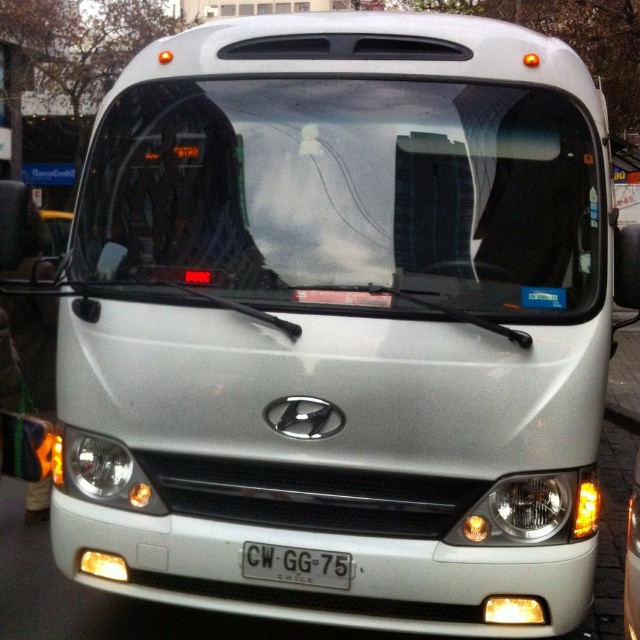
Question: Can you confirm if clear glass windshield at center is positioned above white plastic license plate at center?

Choices:
 (A) yes
 (B) no

Answer: (A)

Question: Can you confirm if clear glass windshield at center is positioned to the left of white plastic license plate at center?

Choices:
 (A) yes
 (B) no

Answer: (B)

Question: Which of the following is the farthest from the observer?

Choices:
 (A) clear glass windshield at center
 (B) matte white headlight at center
 (C) white plastic license plate at center

Answer: (B)

Question: Which point is closer to the camera taking this photo?

Choices:
 (A) (83, 454)
 (B) (202, 177)

Answer: (A)

Question: Can you confirm if white plastic license plate at center is bigger than matte white headlight at center?

Choices:
 (A) no
 (B) yes

Answer: (A)

Question: Among these objects, which one is nearest to the camera?

Choices:
 (A) white plastic license plate at center
 (B) clear glass windshield at center
 (C) matte white headlight at center

Answer: (B)